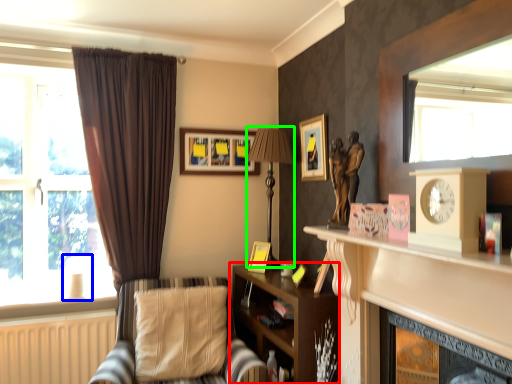
Question: Which object is positioned farthest from shelf (highlighted by a red box)? Select from lamp (highlighted by a blue box) and lamp (highlighted by a green box).

Choices:
 (A) lamp
 (B) lamp

Answer: (A)